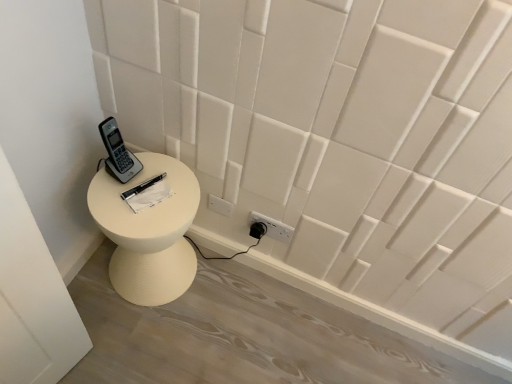
I want to click on vacant space to the right of white matte side table at lower left, so click(224, 305).